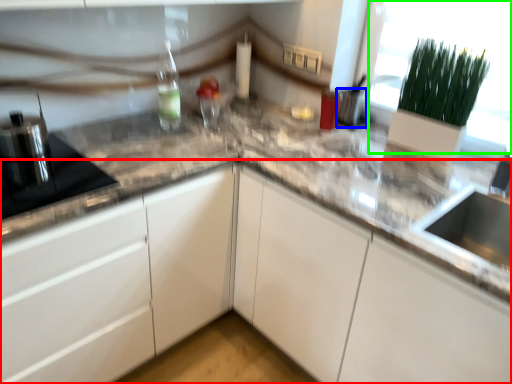
Question: Which object is positioned farthest from cabinetry (highlighted by a red box)? Select from appliance (highlighted by a blue box) and glass door (highlighted by a green box).

Choices:
 (A) appliance
 (B) glass door

Answer: (A)